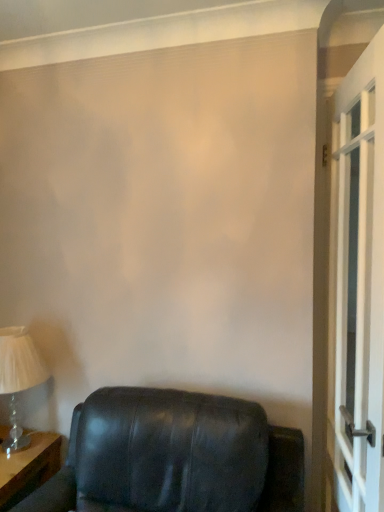
Question: Can you confirm if white glass screen door at right is wider than matte white lampshade at left?

Choices:
 (A) no
 (B) yes

Answer: (A)

Question: Considering the relative positions of white glass screen door at right and matte white lampshade at left in the image provided, is white glass screen door at right in front of matte white lampshade at left?

Choices:
 (A) yes
 (B) no

Answer: (A)

Question: Is white glass screen door at right at the left side of matte white lampshade at left?

Choices:
 (A) yes
 (B) no

Answer: (B)

Question: From a real-world perspective, is white glass screen door at right on top of matte white lampshade at left?

Choices:
 (A) no
 (B) yes

Answer: (B)

Question: Is white glass screen door at right looking in the opposite direction of matte white lampshade at left?

Choices:
 (A) yes
 (B) no

Answer: (A)

Question: From a real-world perspective, is wooden table at lower left above or below matte white lampshade at left?

Choices:
 (A) below
 (B) above

Answer: (A)

Question: Is wooden table at lower left inside the boundaries of matte white lampshade at left, or outside?

Choices:
 (A) outside
 (B) inside

Answer: (A)

Question: In the image, is wooden table at lower left on the left side or the right side of matte white lampshade at left?

Choices:
 (A) left
 (B) right

Answer: (A)

Question: Looking at the image, does wooden table at lower left seem bigger or smaller compared to matte white lampshade at left?

Choices:
 (A) big
 (B) small

Answer: (A)

Question: From a real-world perspective, relative to matte black leather chair at lower left, is white glass screen door at right vertically above or below?

Choices:
 (A) above
 (B) below

Answer: (A)

Question: Is white glass screen door at right to the left or to the right of matte black leather chair at lower left in the image?

Choices:
 (A) right
 (B) left

Answer: (A)

Question: Is point click(x=349, y=298) positioned closer to the camera than point click(x=192, y=458)?

Choices:
 (A) closer
 (B) farther

Answer: (B)

Question: Considering the positions of white glass screen door at right and matte black leather chair at lower left in the image, is white glass screen door at right wider or thinner than matte black leather chair at lower left?

Choices:
 (A) wide
 (B) thin

Answer: (B)

Question: Considering the positions of point (34, 435) and point (110, 437), is point (34, 435) closer or farther from the camera than point (110, 437)?

Choices:
 (A) farther
 (B) closer

Answer: (A)

Question: Is wooden table at lower left in front of or behind matte black leather chair at lower left in the image?

Choices:
 (A) front
 (B) behind

Answer: (B)